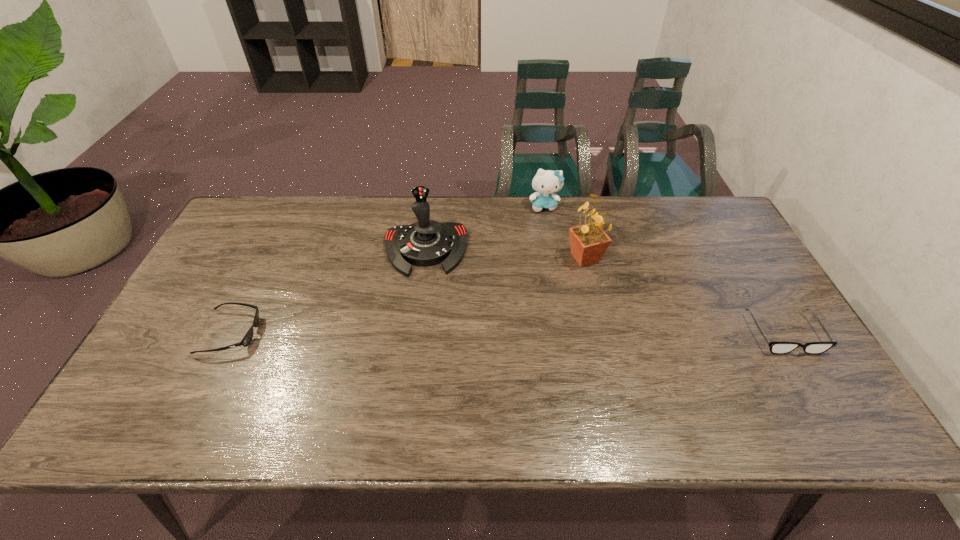
This screenshot has width=960, height=540. I want to click on object that is at the left edge, so click(247, 339).

In order to click on object that is positioned at the right edge in this screenshot , I will do `click(775, 347)`.

The height and width of the screenshot is (540, 960). I want to click on vacant space at the far edge of the desktop, so click(481, 202).

I want to click on vacant area at the near edge, so click(702, 374).

Identify the location of vacant region at the left edge of the desktop. (210, 299).

Identify the location of vacant area at the right edge of the desktop. The height and width of the screenshot is (540, 960). (750, 295).

Where is `vacant area that lies between the rightmost object and the second object from left to right`? vacant area that lies between the rightmost object and the second object from left to right is located at coordinates (605, 292).

You are a GUI agent. You are given a task and a screenshot of the screen. Output one action in this format:
    pyautogui.click(x=<x>, y=<y>)
    Task: Click on the blank region between the shortest object and the sunflower
    This screenshot has width=960, height=540.
    Given the screenshot: What is the action you would take?
    pyautogui.click(x=408, y=295)

The height and width of the screenshot is (540, 960). In order to click on empty space that is in between the fourth object from right to left and the kitten in this screenshot , I will do `click(485, 228)`.

I want to click on free space between the third shortest object and the joystick, so click(485, 228).